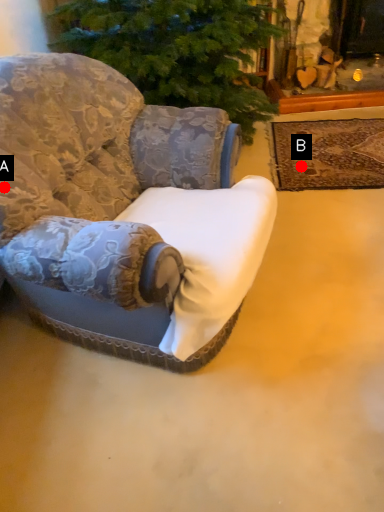
Question: Two points are circled on the image, labeled by A and B beside each circle. Which point is closer to the camera?

Choices:
 (A) A is closer
 (B) B is closer

Answer: (A)